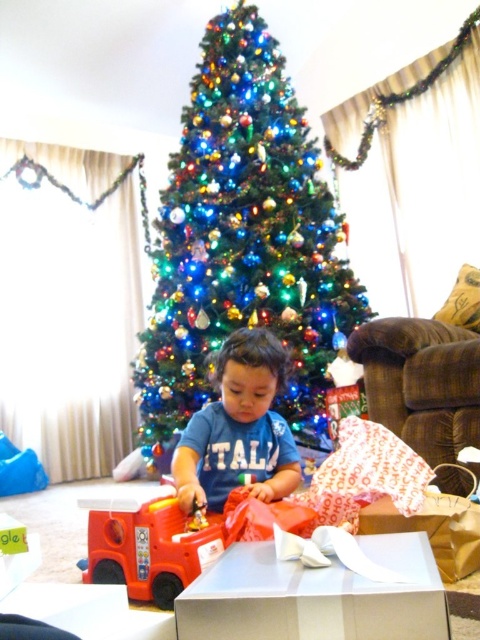
Can you confirm if white glossy box at center is positioned to the left of rubber fire truck at lower left?

In fact, white glossy box at center is to the right of rubber fire truck at lower left.

Is the position of white glossy box at center less distant than that of rubber fire truck at lower left?

Yes, white glossy box at center is in front of rubber fire truck at lower left.

Between point (436, 621) and point (166, 561), which one is positioned in front?

Point (436, 621) is in front.

I want to click on white glossy box at center, so click(x=315, y=596).

Between point (283, 77) and point (425, 536), which one is positioned in front?

Positioned in front is point (425, 536).

Is green artificial christmas tree at center to the left of white glossy box at center from the viewer's perspective?

Indeed, green artificial christmas tree at center is positioned on the left side of white glossy box at center.

What are the coordinates of `green artificial christmas tree at center` in the screenshot? It's located at (241, 241).

The height and width of the screenshot is (640, 480). Identify the location of green artificial christmas tree at center. (241, 241).

Which is above, white glossy box at center or matte blue shirt at center?

matte blue shirt at center is above.

Looking at this image, is white glossy box at center above matte blue shirt at center?

Incorrect, white glossy box at center is not positioned above matte blue shirt at center.

Is point (321, 627) farther from camera compared to point (288, 428)?

No, (321, 627) is closer to viewer.

The height and width of the screenshot is (640, 480). Identify the location of white glossy box at center. (315, 596).